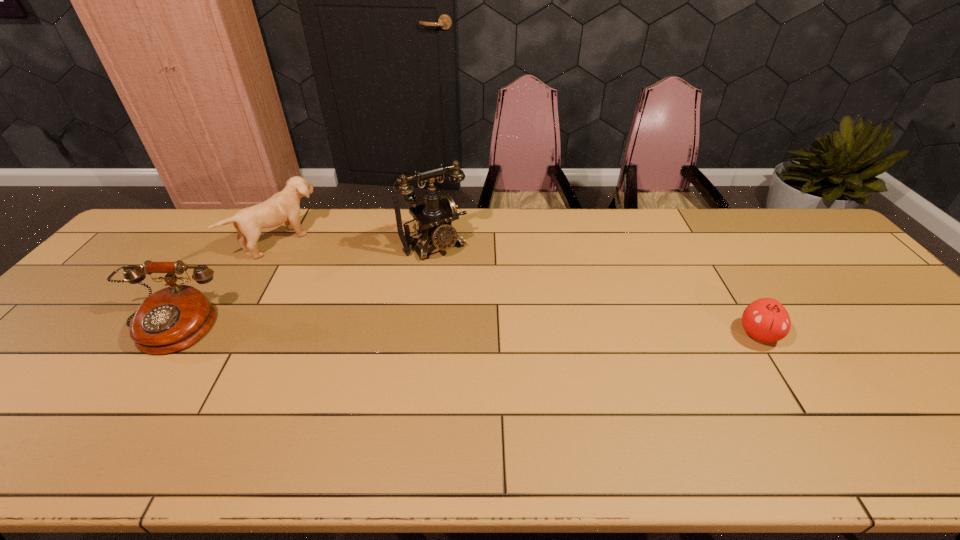
Find the location of a particular element. The image size is (960, 540). vacant space on the desktop that is between the nearer telephone and the shortest object and is positioned on the rotary dial of the farther telephone is located at coordinates (507, 332).

Locate an element on the screen. vacant spot on the desktop that is between the left telephone and the shortest object and is positioned on the left side of the puppy is located at coordinates (407, 330).